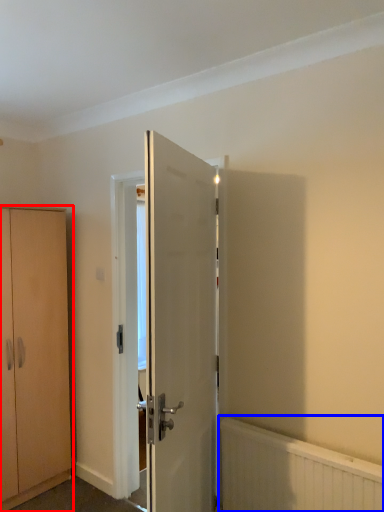
Question: Among these objects, which one is farthest to the camera, cabinetry (highlighted by a red box) or radiator (highlighted by a blue box)?

Choices:
 (A) cabinetry
 (B) radiator

Answer: (A)